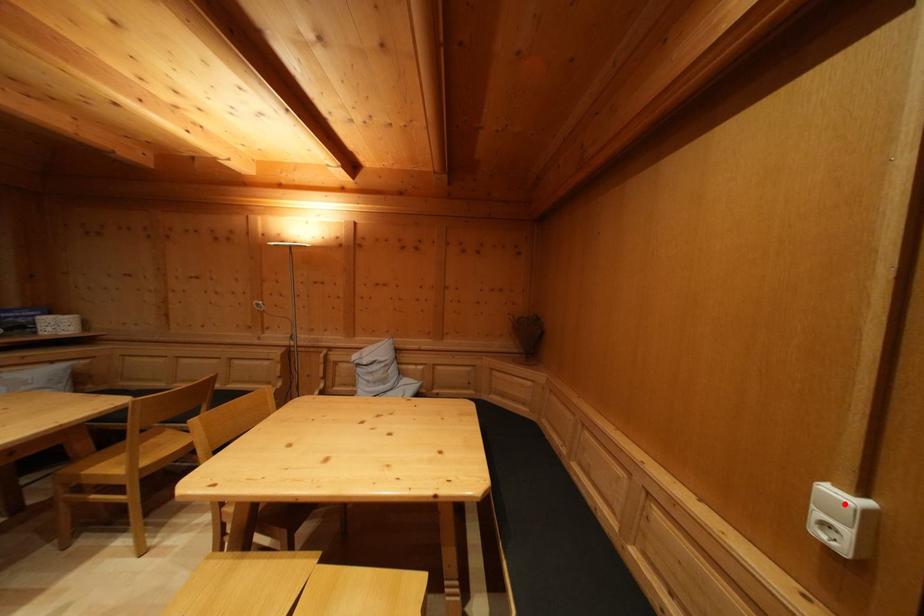
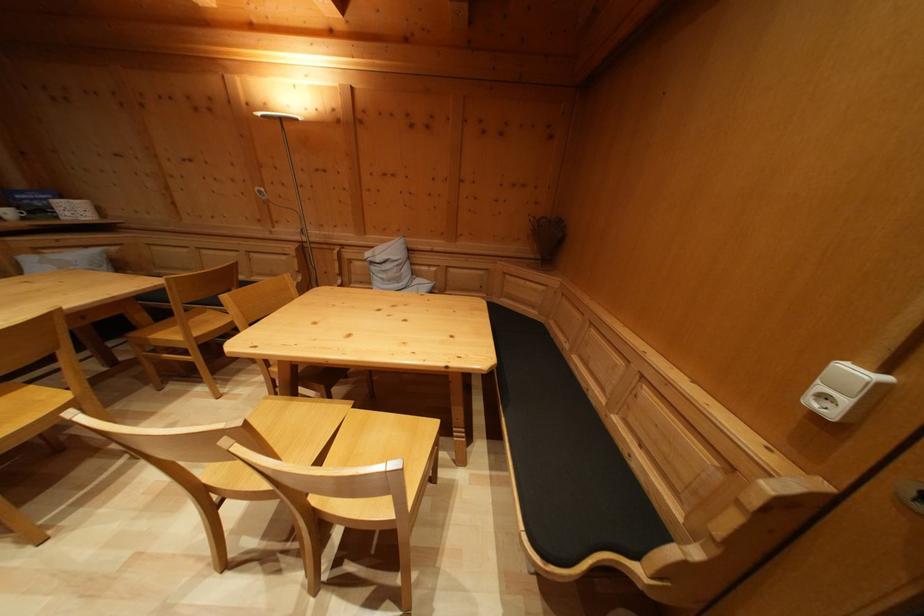
Where in the second image is the point corresponding to the highlighted location from the first image?

(859, 379)